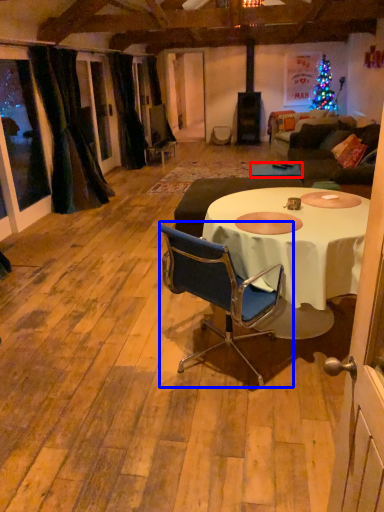
Question: Which point is closer to the camera, table (highlighted by a red box) or chair (highlighted by a blue box)?

Choices:
 (A) table
 (B) chair

Answer: (B)